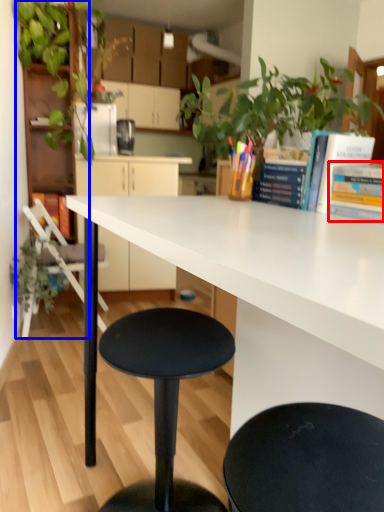
Question: Which object appears farthest to the camera in this image, book (highlighted by a red box) or bookshelf (highlighted by a blue box)?

Choices:
 (A) book
 (B) bookshelf

Answer: (B)